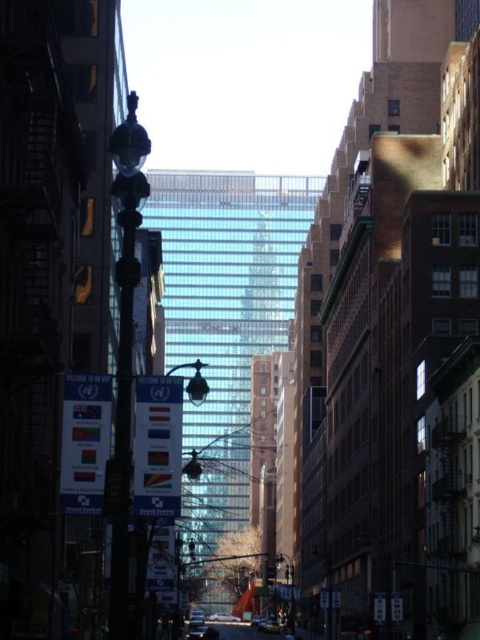
Question: Can you confirm if black glass lamp post at center is wider than metallic silver car at center?

Choices:
 (A) yes
 (B) no

Answer: (B)

Question: Is shiny black pole at left wider than metallic streetlamp at center?

Choices:
 (A) yes
 (B) no

Answer: (A)

Question: Which object is positioned closest to the black glass lamp post at center?

Choices:
 (A) silver metallic sedan at center
 (B) metallic silver car at center
 (C) shiny black pole at left
 (D) metallic streetlamp at center

Answer: (B)

Question: Among these objects, which one is farthest from the camera?

Choices:
 (A) black glass lamp post at center
 (B) metallic silver car at center
 (C) metallic streetlamp at center
 (D) silver metallic sedan at center

Answer: (D)

Question: From the image, what is the correct spatial relationship of metallic streetlamp at center in relation to black glass lamp post at center?

Choices:
 (A) right
 (B) left

Answer: (B)

Question: Which of the following is the farthest from the observer?

Choices:
 (A) black glass lamp post at center
 (B) metallic silver car at center
 (C) silver metallic sedan at center
 (D) shiny black pole at left

Answer: (C)